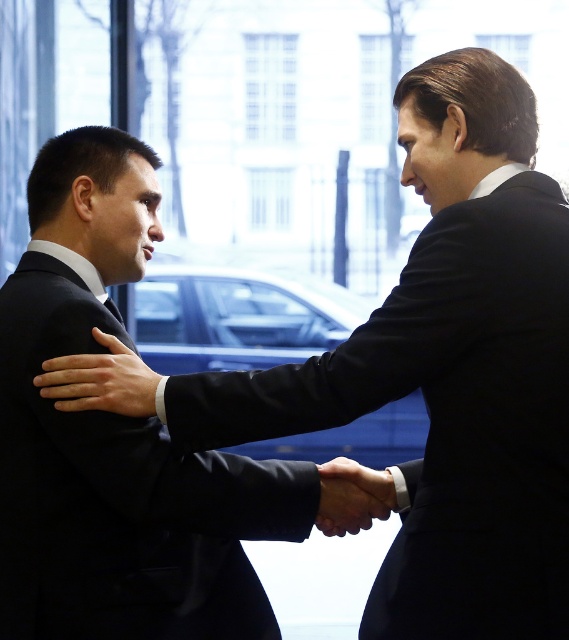
Question: Which object appears closest to the camera in this image?

Choices:
 (A) smooth leather hand at center
 (B) black satin suit at left

Answer: (B)

Question: Which point appears farthest from the camera in this image?

Choices:
 (A) (117, 365)
 (B) (212, 604)
 (C) (345, 476)

Answer: (C)

Question: Where is black satin suit at left located in relation to smooth leather hand at center in the image?

Choices:
 (A) below
 (B) above

Answer: (B)

Question: Can you confirm if black satin suit at left is positioned to the right of smooth skin hand at center?

Choices:
 (A) no
 (B) yes

Answer: (A)

Question: Which point is closer to the camera taking this photo?

Choices:
 (A) (376, 509)
 (B) (151, 404)

Answer: (B)

Question: Can you confirm if black satin suit at left is positioned to the right of smooth skin hand at center?

Choices:
 (A) no
 (B) yes

Answer: (A)